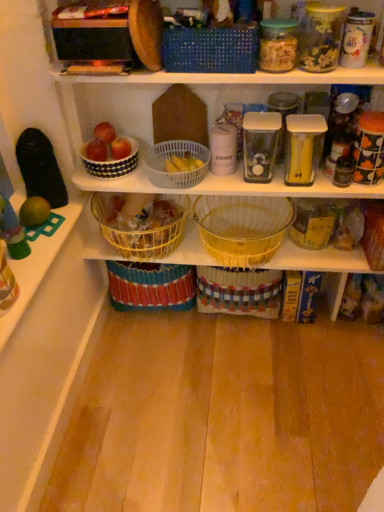
Where is `free space to the left of black glass jar at right`? This screenshot has width=384, height=512. free space to the left of black glass jar at right is located at coordinates (306, 181).